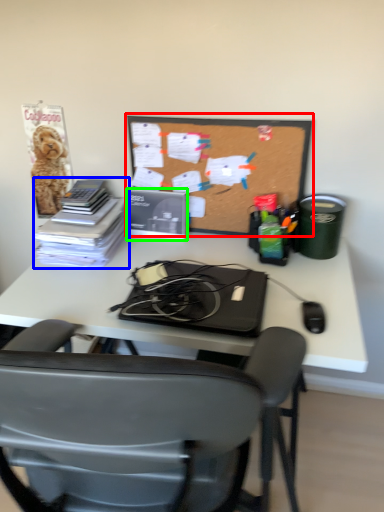
Question: Which object is positioned farthest from bulletin board (highlighted by a red box)? Select from book (highlighted by a blue box) and paperback book (highlighted by a green box).

Choices:
 (A) book
 (B) paperback book

Answer: (A)